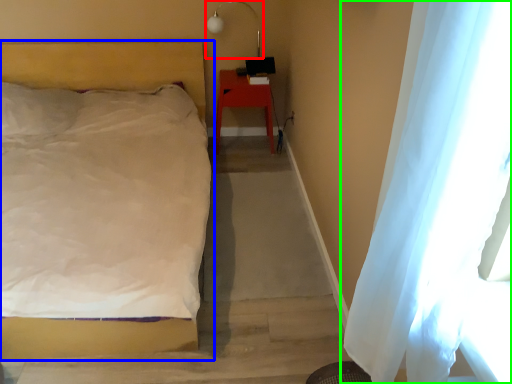
Question: Estimate the real-world distances between objects in this image. Which object is farther from lamp (highlighted by a red box), bed (highlighted by a blue box) or curtain (highlighted by a green box)?

Choices:
 (A) bed
 (B) curtain

Answer: (B)